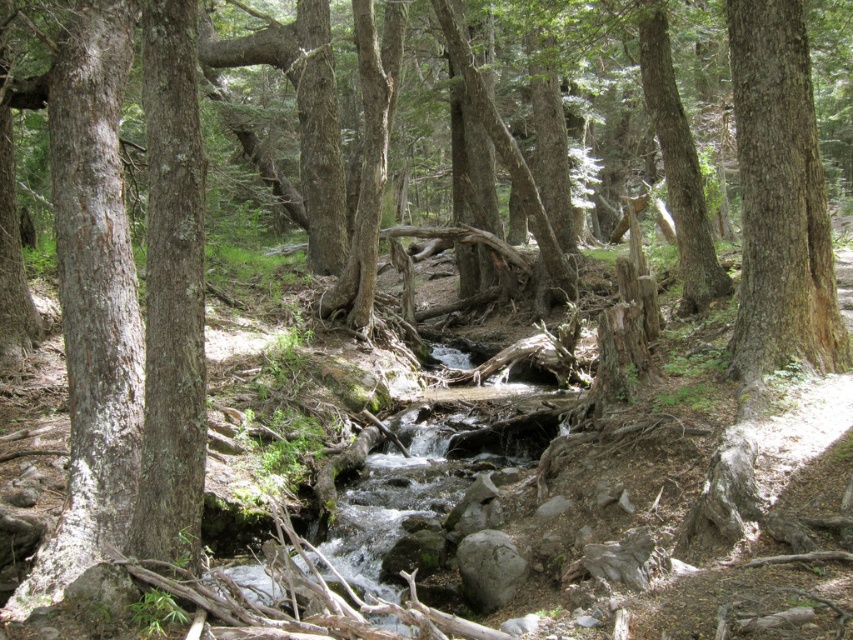
You are a hiker trying to cross the stream in the forest. You see a smooth bark tree at center and a gray rough rock at center. Which object is wider, and can you use the wider one as a stepping stone?

The smooth bark tree at center is wider than the gray rough rock at center. However, since the tree is a living plant, it is not advisable to use it as a stepping stone. Please use the gray rough rock at center instead for safe crossing.

You are a hiker trying to cross the stream in the forest. You see a smooth bark tree at center and a gray rough rock at center. Which object can you use as a stepping stone to cross the stream safely?

The gray rough rock at center can be used as a stepping stone to cross the stream safely since it is smaller and more stable underfoot compared to the smooth bark tree at center.